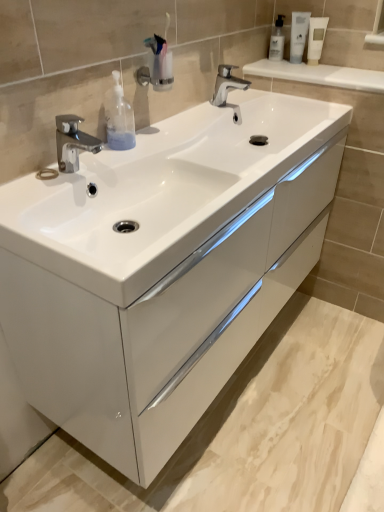
Image resolution: width=384 pixels, height=512 pixels. In order to click on free space on the front side of polished chrome faucet at left, which is the 1th tap from left to right in this screenshot , I will do `click(38, 199)`.